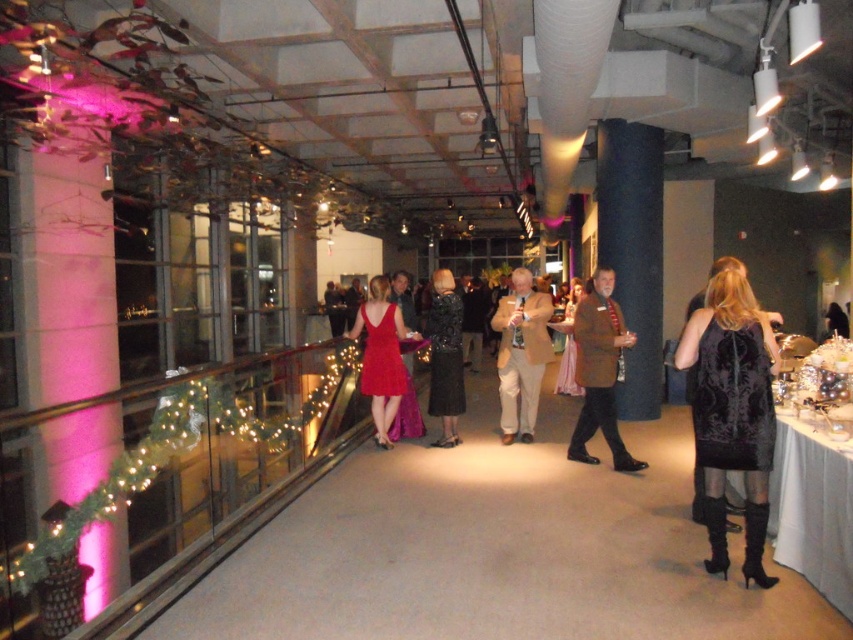
Question: Does velvet black dress at right have a smaller size compared to tan fabric suit at center?

Choices:
 (A) no
 (B) yes

Answer: (B)

Question: Which point is closer to the camera?

Choices:
 (A) shiny red dress at center
 (B) brown textured coat at center

Answer: (B)

Question: Which of the following is the farthest from the observer?

Choices:
 (A) (612, 349)
 (B) (393, 376)
 (C) (700, 397)
 (D) (840, 454)

Answer: (B)

Question: Can you confirm if white satin table at lower right is bigger than tan fabric suit at center?

Choices:
 (A) no
 (B) yes

Answer: (A)

Question: Which point is farther to the camera?

Choices:
 (A) (535, 369)
 (B) (364, 321)

Answer: (A)

Question: Is brown textured coat at center positioned behind shiny red dress at center?

Choices:
 (A) yes
 (B) no

Answer: (B)